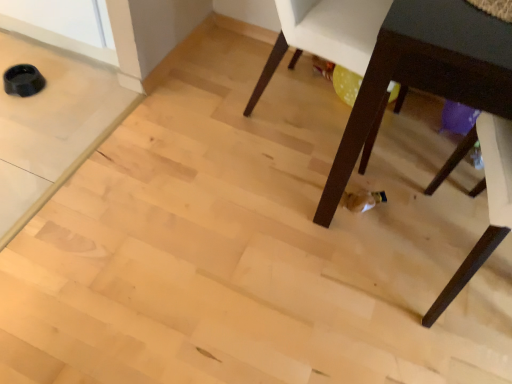
Locate an element on the screen. vacant space situated on the left part of white plastic chair at center, acting as the 2th chair starting from the right is located at coordinates (209, 99).